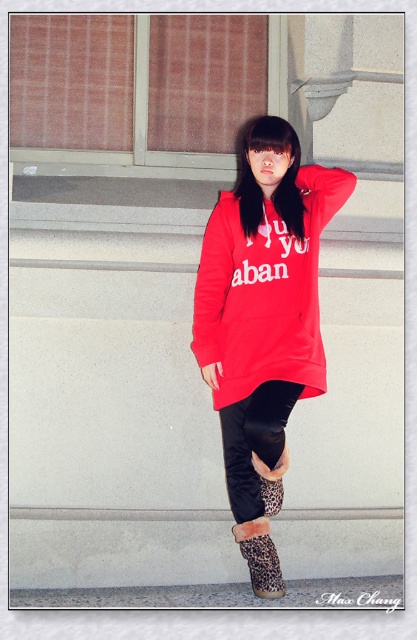
You are a fashion designer trying to create a coordinated outfit using the matte red sweatshirt at center and the leopard print fur boots at lower center. Which item should you consider first when planning the outfit to ensure proper proportions?

The matte red sweatshirt at center is larger in size than the leopard print fur boots at lower center, so you should start by selecting the larger item, the matte red sweatshirt at center, to establish the dominant piece of the outfit.

You are a fashion designer who wants to create a new outfit inspired by the image. You need to ensure that the placement of the matte red sweatshirt at center and leopard print fur boots at lower center in your design matches their positions in the original image. Which object should be placed to the right of the other?

The matte red sweatshirt at center should be placed to the right of the leopard print fur boots at lower center, as described in the scene.

You are a fashion designer trying to create a new outfit. You see a matte red sweatshirt at center and leopard print fur boots at lower center. Which item is taller in the image?

The matte red sweatshirt at center is taller than the leopard print fur boots at lower center.